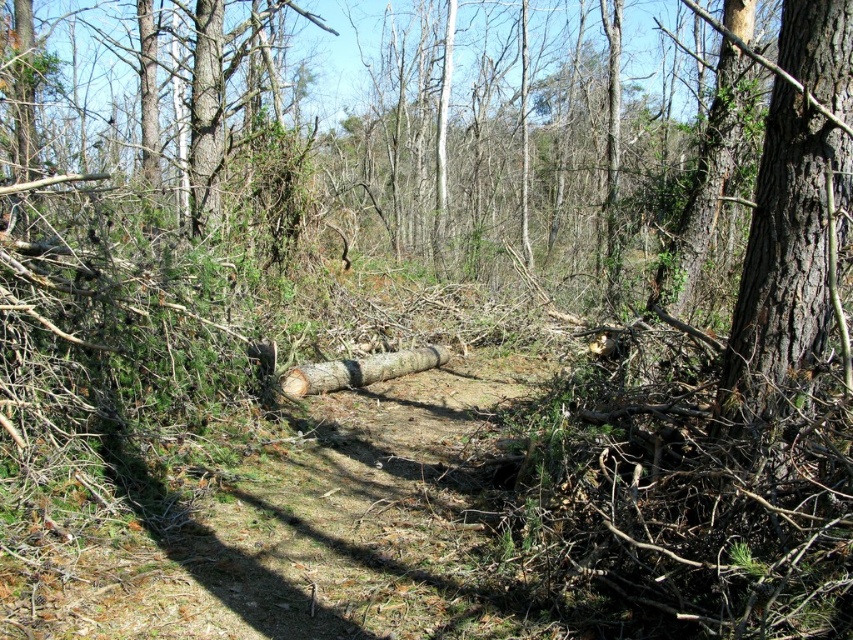
Can you confirm if smooth brown bark at right is shorter than brown rough log at center?

No, smooth brown bark at right is not shorter than brown rough log at center.

Who is positioned more to the right, smooth brown bark at right or brown rough log at center?

smooth brown bark at right

Locate an element on the screen. Image resolution: width=853 pixels, height=640 pixels. smooth brown bark at right is located at coordinates (790, 232).

This screenshot has width=853, height=640. Identify the location of smooth brown bark at right. (790, 232).